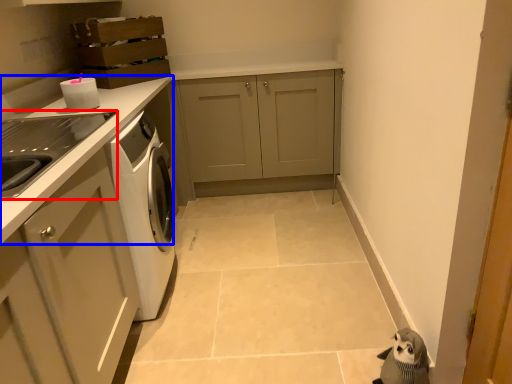
Question: Which of the following is the closest to the observer, home appliance (highlighted by a red box) or countertop (highlighted by a blue box)?

Choices:
 (A) home appliance
 (B) countertop

Answer: (A)